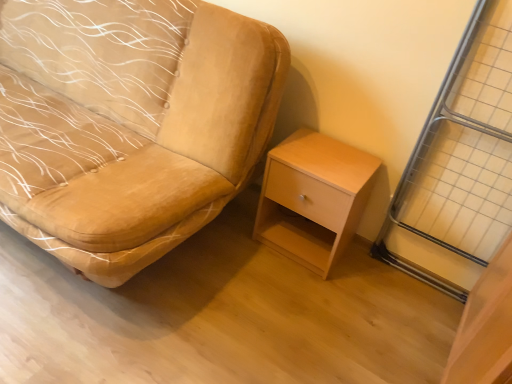
At what (x,y) coordinates should I click in order to perform the action: click on free space to the left of metallic silver screen door at right. Please return your answer as a coordinate pair (x, y). The image size is (512, 384). Looking at the image, I should click on (367, 285).